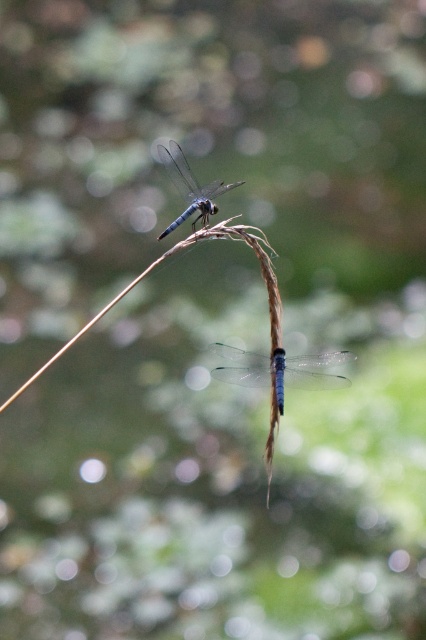
Question: Which object appears farthest from the camera in this image?

Choices:
 (A) transparent blue dragonfly at center
 (B) blue translucent dragonfly at upper center

Answer: (B)

Question: Does transparent blue dragonfly at center have a lesser width compared to blue translucent dragonfly at upper center?

Choices:
 (A) yes
 (B) no

Answer: (B)

Question: Which point is closer to the camera?

Choices:
 (A) blue translucent dragonfly at upper center
 (B) transparent blue dragonfly at center

Answer: (B)

Question: Which point is farther to the camera?

Choices:
 (A) (224, 189)
 (B) (276, 364)

Answer: (A)

Question: Can you confirm if transparent blue dragonfly at center is thinner than blue translucent dragonfly at upper center?

Choices:
 (A) yes
 (B) no

Answer: (B)

Question: Is transparent blue dragonfly at center smaller than blue translucent dragonfly at upper center?

Choices:
 (A) yes
 (B) no

Answer: (A)